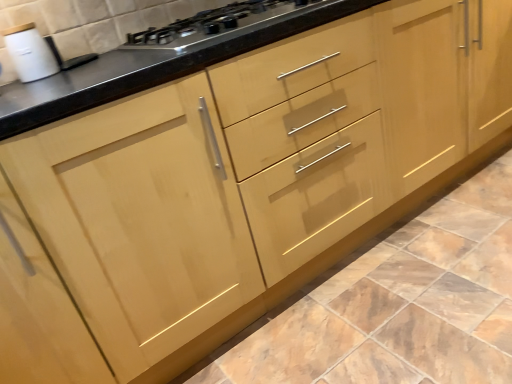
Question: Can you confirm if matte brown cabinet at center is taller than satin black gas stove at upper center?

Choices:
 (A) yes
 (B) no

Answer: (B)

Question: Considering the relative positions of matte brown cabinet at center and satin black gas stove at upper center in the image provided, is matte brown cabinet at center to the right of satin black gas stove at upper center from the viewer's perspective?

Choices:
 (A) no
 (B) yes

Answer: (B)

Question: Is the surface of matte brown cabinet at center in direct contact with satin black gas stove at upper center?

Choices:
 (A) yes
 (B) no

Answer: (B)

Question: Does matte brown cabinet at center have a smaller size compared to satin black gas stove at upper center?

Choices:
 (A) yes
 (B) no

Answer: (B)

Question: From the image's perspective, is matte brown cabinet at center beneath satin black gas stove at upper center?

Choices:
 (A) yes
 (B) no

Answer: (A)

Question: Considering the positions of satin black gas stove at upper center and matte brown cabinet at center in the image, is satin black gas stove at upper center taller or shorter than matte brown cabinet at center?

Choices:
 (A) tall
 (B) short

Answer: (A)

Question: In terms of width, does satin black gas stove at upper center look wider or thinner when compared to matte brown cabinet at center?

Choices:
 (A) wide
 (B) thin

Answer: (B)

Question: Is satin black gas stove at upper center to the left or to the right of matte brown cabinet at center in the image?

Choices:
 (A) right
 (B) left

Answer: (B)

Question: Does point (147, 34) appear closer or farther from the camera than point (492, 226)?

Choices:
 (A) farther
 (B) closer

Answer: (B)

Question: From a real-world perspective, is white glossy sink at upper left above or below matte brown cabinet at center?

Choices:
 (A) above
 (B) below

Answer: (A)

Question: From the image's perspective, is white glossy sink at upper left positioned above or below matte brown cabinet at center?

Choices:
 (A) below
 (B) above

Answer: (B)

Question: In the image, is white glossy sink at upper left on the left side or the right side of matte brown cabinet at center?

Choices:
 (A) left
 (B) right

Answer: (A)

Question: Considering their positions, is white glossy sink at upper left located in front of or behind matte brown cabinet at center?

Choices:
 (A) front
 (B) behind

Answer: (B)

Question: Is matte brown cabinet at center taller or shorter than white glossy sink at upper left?

Choices:
 (A) tall
 (B) short

Answer: (B)

Question: Looking at their shapes, would you say matte brown cabinet at center is wider or thinner than white glossy sink at upper left?

Choices:
 (A) wide
 (B) thin

Answer: (A)